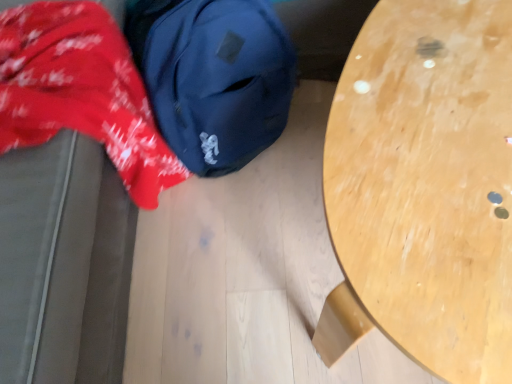
Question: Can you confirm if red cotton fabric at left is thinner than navy blue fabric backpack at upper left?

Choices:
 (A) no
 (B) yes

Answer: (A)

Question: From the image's perspective, is red cotton fabric at left on top of navy blue fabric backpack at upper left?

Choices:
 (A) yes
 (B) no

Answer: (B)

Question: From a real-world perspective, is red cotton fabric at left below navy blue fabric backpack at upper left?

Choices:
 (A) no
 (B) yes

Answer: (A)

Question: Can navy blue fabric backpack at upper left be found inside red cotton fabric at left?

Choices:
 (A) yes
 (B) no

Answer: (B)

Question: Does red cotton fabric at left turn towards navy blue fabric backpack at upper left?

Choices:
 (A) no
 (B) yes

Answer: (B)

Question: Is red cotton fabric at left positioned behind navy blue fabric backpack at upper left?

Choices:
 (A) no
 (B) yes

Answer: (A)

Question: Is navy blue fabric backpack at upper left oriented towards red cotton fabric at left?

Choices:
 (A) no
 (B) yes

Answer: (A)

Question: Considering the relative sizes of navy blue fabric backpack at upper left and red cotton fabric at left in the image provided, is navy blue fabric backpack at upper left wider than red cotton fabric at left?

Choices:
 (A) no
 (B) yes

Answer: (A)

Question: Does navy blue fabric backpack at upper left lie in front of red cotton fabric at left?

Choices:
 (A) yes
 (B) no

Answer: (B)

Question: Can you confirm if navy blue fabric backpack at upper left is positioned to the right of red cotton fabric at left?

Choices:
 (A) yes
 (B) no

Answer: (A)

Question: Is navy blue fabric backpack at upper left taller than red cotton fabric at left?

Choices:
 (A) yes
 (B) no

Answer: (B)

Question: Considering the relative sizes of navy blue fabric backpack at upper left and red cotton fabric at left in the image provided, is navy blue fabric backpack at upper left smaller than red cotton fabric at left?

Choices:
 (A) no
 (B) yes

Answer: (B)

Question: Is light wood table at center completely or partially outside of red cotton fabric at left?

Choices:
 (A) yes
 (B) no

Answer: (A)